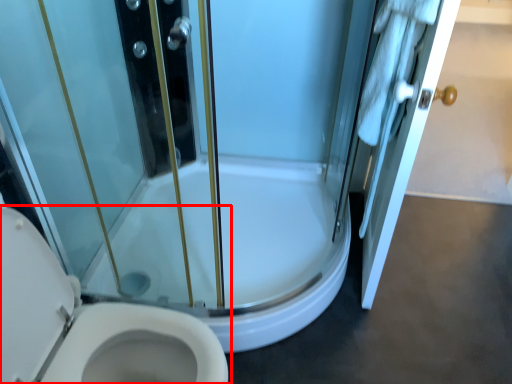
Question: From the image's perspective, considering the relative positions of toilet (annotated by the red box) and door in the image provided, where is toilet (annotated by the red box) located with respect to the staircase?

Choices:
 (A) below
 (B) above

Answer: (A)